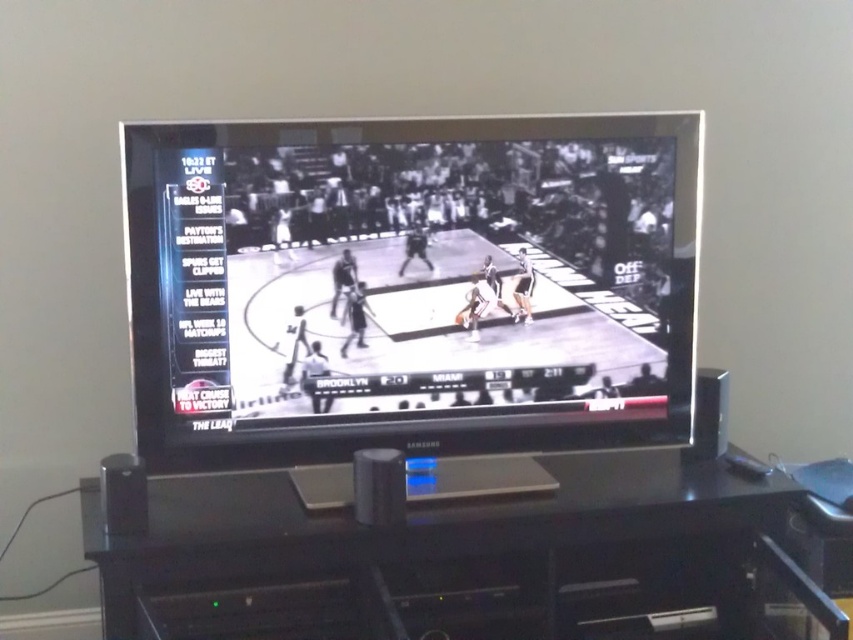
You are arranging a small plant on the shelf of the black plastic entertainment center at lower center. If you want to place a second plant so it is directly to the right of the first one, where should you place it relative to the black glossy basketball court at center?

The black glossy basketball court at center is to the left of the black plastic entertainment center at lower center. Therefore, placing the second plant to the right of the first one on the entertainment center would position it further to the right relative to the basketball court.

You are trying to hang a picture frame that is 1.2 meters tall on the wall behind the black glossy basketball court at center and the black plastic entertainment center at lower center. Based on the height of these objects, which one should you place the frame above to ensure it is visible?

The black glossy basketball court at center is taller than the black plastic entertainment center at lower center. To ensure visibility, place the frame above the black plastic entertainment center at lower center since it is shorter.

You are sitting on a couch in the living room and want to watch the basketball game on the TV. Which object is closer to your eyes between the black glossy basketball court at center and the black plastic entertainment center at lower center?

The black glossy basketball court at center is above the black plastic entertainment center at lower center, so the basketball court at center is closer to your eyes.